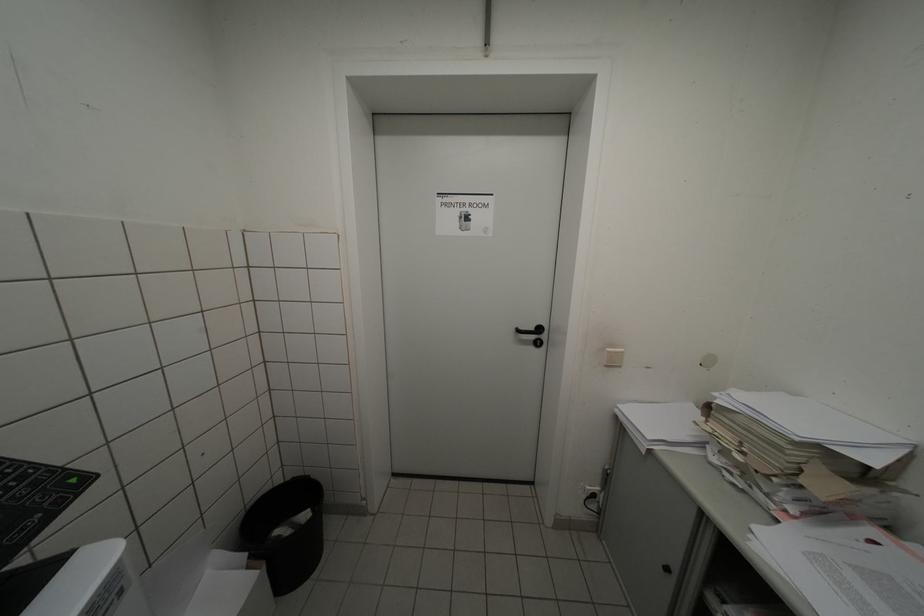
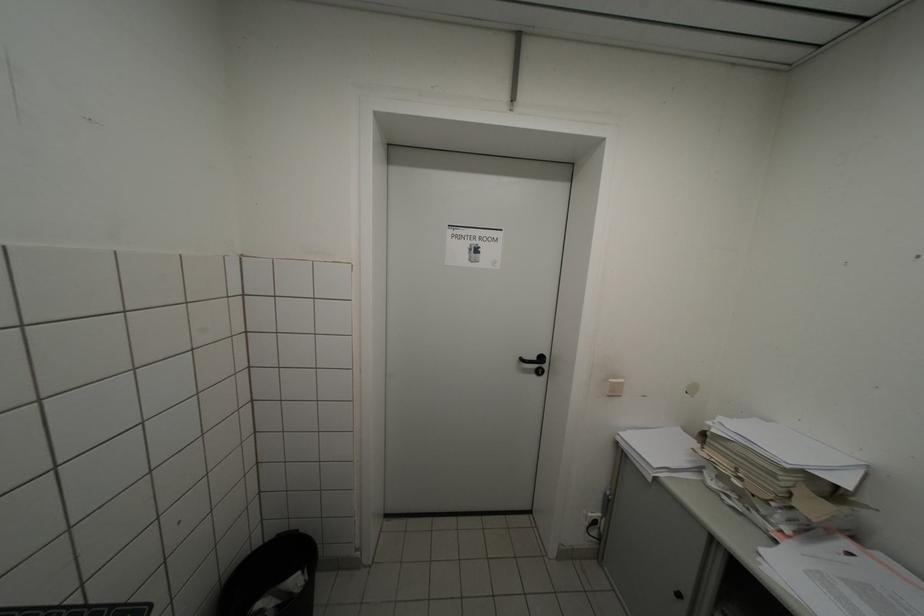
Question: The first image is from the beginning of the video and the second image is from the end. How did the camera likely rotate when shooting the video?

Choices:
 (A) Left
 (B) Right
 (C) Up
 (D) Down

Answer: (B)